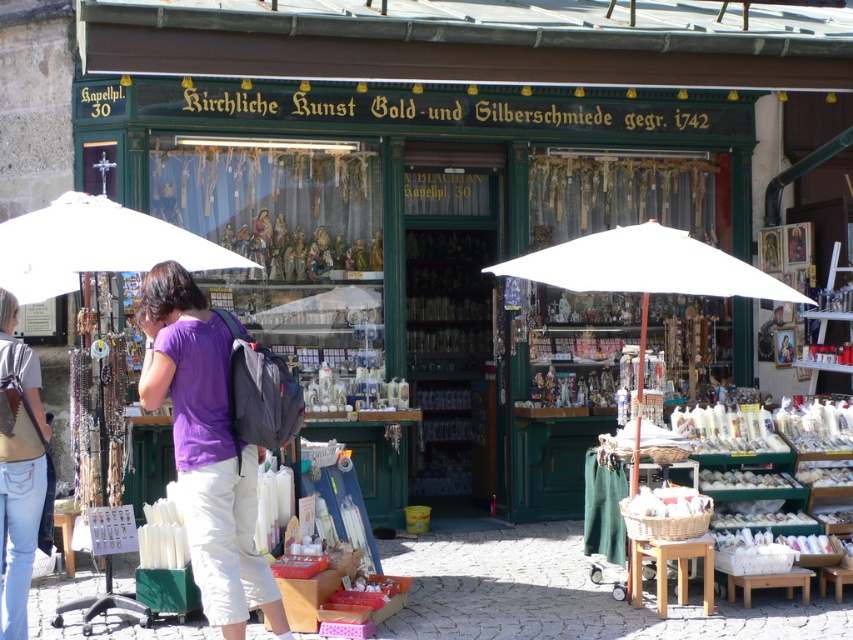
You are standing on the street in front of the shop and see the white fabric umbrella at center and the denim jeans at lower left. Which object appears shorter in the image?

The white fabric umbrella at center appears shorter than the denim jeans at lower left because it has a lesser height compared to the denim jeans at lower left.

You are a customer standing in front of the shop and see a person wearing a purple fabric shirt at center and denim jeans at lower left. Which clothing item is taller?

The purple fabric shirt at center has a greater height compared to the denim jeans at lower left, so the purple fabric shirt at center is taller.